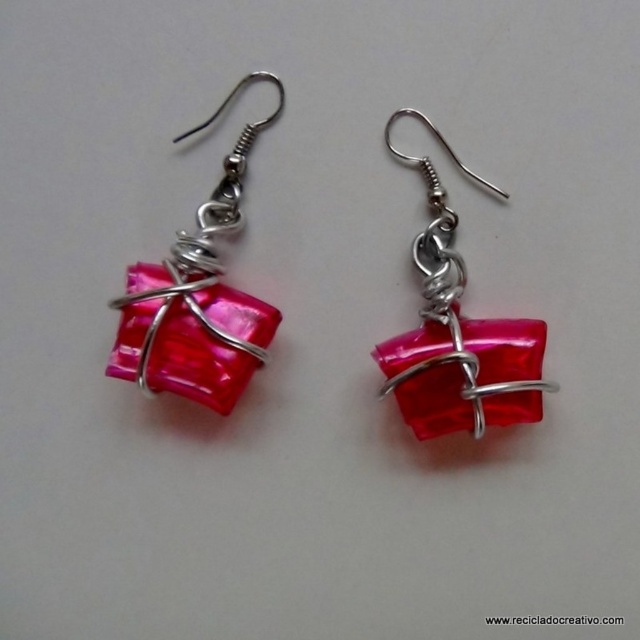
Question: Which object appears closest to the camera in this image?

Choices:
 (A) pink glossy cube at center
 (B) glossy red cube at center

Answer: (A)

Question: Can you confirm if pink glossy cube at center is wider than glossy red cube at center?

Choices:
 (A) no
 (B) yes

Answer: (A)

Question: Is pink glossy cube at center further to camera compared to glossy red cube at center?

Choices:
 (A) yes
 (B) no

Answer: (B)

Question: Among these points, which one is farthest from the camera?

Choices:
 (A) (x=115, y=346)
 (B) (x=419, y=116)

Answer: (B)

Question: Is pink glossy cube at center positioned in front of glossy red cube at center?

Choices:
 (A) no
 (B) yes

Answer: (B)